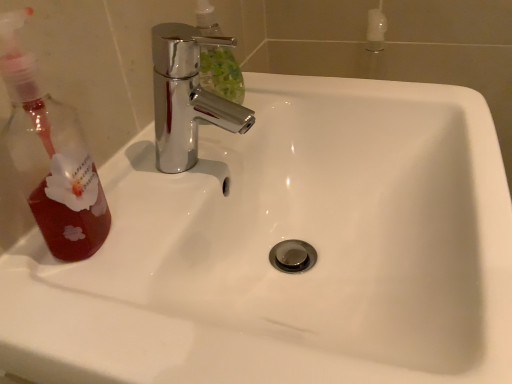
What do you see at coordinates (187, 96) in the screenshot? I see `chrome metallic faucet at upper center` at bounding box center [187, 96].

What is the approximate height of chrome metallic faucet at upper center?

It is 14.98 centimeters.

This screenshot has height=384, width=512. I want to click on chrome metallic faucet at upper center, so click(187, 96).

What do you see at coordinates (53, 165) in the screenshot? Image resolution: width=512 pixels, height=384 pixels. I see `translucent red liquid at left` at bounding box center [53, 165].

Find the location of a particular element. This screenshot has width=512, height=384. translucent red liquid at left is located at coordinates (53, 165).

The image size is (512, 384). In order to click on chrome metallic faucet at upper center in this screenshot , I will do `click(187, 96)`.

Is translucent red liquid at left at the left side of chrome metallic faucet at upper center?

Indeed, translucent red liquid at left is positioned on the left side of chrome metallic faucet at upper center.

Considering the positions of objects translucent red liquid at left and chrome metallic faucet at upper center in the image provided, who is behind, translucent red liquid at left or chrome metallic faucet at upper center?

Positioned behind is chrome metallic faucet at upper center.

Is point (28, 158) farther from viewer compared to point (224, 125)?

No, it is not.

From the image's perspective, would you say translucent red liquid at left is positioned over chrome metallic faucet at upper center?

No, from the image's perspective, translucent red liquid at left is not on top of chrome metallic faucet at upper center.

From a real-world perspective, is translucent red liquid at left located higher than chrome metallic faucet at upper center?

Correct, in the physical world, translucent red liquid at left is higher than chrome metallic faucet at upper center.

Which of these two, translucent red liquid at left or chrome metallic faucet at upper center, is thinner?

Thinner between the two is translucent red liquid at left.

Can you confirm if translucent red liquid at left is shorter than chrome metallic faucet at upper center?

Incorrect, the height of translucent red liquid at left does not fall short of that of chrome metallic faucet at upper center.

From the picture: Considering the sizes of objects translucent red liquid at left and chrome metallic faucet at upper center in the image provided, who is smaller, translucent red liquid at left or chrome metallic faucet at upper center?

translucent red liquid at left.

Would you say translucent red liquid at left contains chrome metallic faucet at upper center?

No, chrome metallic faucet at upper center is not surrounded by translucent red liquid at left.

Is translucent red liquid at left with chrome metallic faucet at upper center?

No, translucent red liquid at left is not in contact with chrome metallic faucet at upper center.

Is chrome metallic faucet at upper center at the back of translucent red liquid at left?

No.

How different are the orientations of translucent red liquid at left and chrome metallic faucet at upper center in degrees?

0.000716 degrees.

Measure the distance between translucent red liquid at left and chrome metallic faucet at upper center.

translucent red liquid at left is 18.00 centimeters from chrome metallic faucet at upper center.

The width and height of the screenshot is (512, 384). In order to click on mouthwash on the left of chrome metallic faucet at upper center in this screenshot , I will do point(53,165).

Which object is positioned more to the right, chrome metallic faucet at upper center or translucent red liquid at left?

chrome metallic faucet at upper center is more to the right.

In the image, is chrome metallic faucet at upper center positioned in front of or behind translucent red liquid at left?

Visually, chrome metallic faucet at upper center is located behind translucent red liquid at left.

Is point (170, 87) closer or farther from the camera than point (31, 194)?

Clearly, point (170, 87) is more distant from the camera than point (31, 194).

From the image's perspective, does chrome metallic faucet at upper center appear higher than translucent red liquid at left?

Yes, from the image's perspective, chrome metallic faucet at upper center is over translucent red liquid at left.

From a real-world perspective, who is located lower, chrome metallic faucet at upper center or translucent red liquid at left?

chrome metallic faucet at upper center.

Can you confirm if chrome metallic faucet at upper center is thinner than translucent red liquid at left?

Incorrect, the width of chrome metallic faucet at upper center is not less than that of translucent red liquid at left.

Does chrome metallic faucet at upper center have a lesser height compared to translucent red liquid at left?

Correct, chrome metallic faucet at upper center is not as tall as translucent red liquid at left.

Considering the sizes of objects chrome metallic faucet at upper center and translucent red liquid at left in the image provided, who is bigger, chrome metallic faucet at upper center or translucent red liquid at left?

chrome metallic faucet at upper center is bigger.

Would you say chrome metallic faucet at upper center is outside translucent red liquid at left?

That's correct, chrome metallic faucet at upper center is outside of translucent red liquid at left.

Is chrome metallic faucet at upper center touching translucent red liquid at left?

No, chrome metallic faucet at upper center is not next to translucent red liquid at left.

In the scene shown: Is chrome metallic faucet at upper center positioned with its back to translucent red liquid at left?

No, chrome metallic faucet at upper center's orientation is not away from translucent red liquid at left.

Measure the distance from chrome metallic faucet at upper center to translucent red liquid at left.

chrome metallic faucet at upper center and translucent red liquid at left are 7.09 inches apart.

You are a GUI agent. You are given a task and a screenshot of the screen. Output one action in this format:
    pyautogui.click(x=<x>, y=<y>)
    Task: Click on the tap beneath the translucent red liquid at left (from a real-world perspective)
    
    Given the screenshot: What is the action you would take?
    pyautogui.click(x=187, y=96)

In the image, there is a translucent red liquid at left. Identify the location of tap below it (from a real-world perspective). (187, 96).

Locate an element on the screen. The image size is (512, 384). tap that appears on the right of translucent red liquid at left is located at coordinates (187, 96).